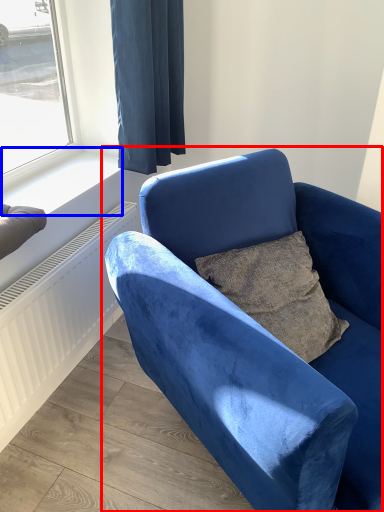
Question: Which object is further to the camera taking this photo, chair (highlighted by a red box) or window sill (highlighted by a blue box)?

Choices:
 (A) chair
 (B) window sill

Answer: (B)